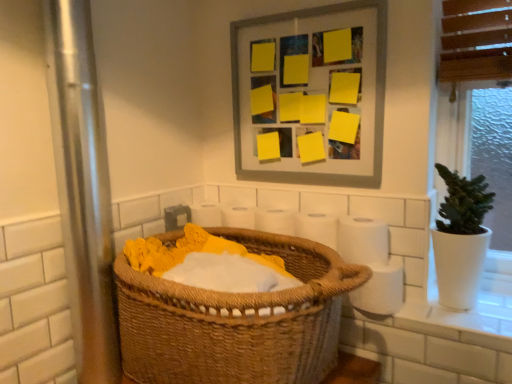
Question: From the image's perspective, is white matte toilet paper at right, which is counted as the 2th toilet paper, starting from the top, positioned above or below white matte toilet paper at right, which appears as the first toilet paper when ordered from the bottom?

Choices:
 (A) below
 (B) above

Answer: (B)

Question: From a real-world perspective, is white matte toilet paper at right, the 2th toilet paper positioned from the bottom, physically located above or below white matte toilet paper at right, which appears as the first toilet paper when ordered from the bottom?

Choices:
 (A) above
 (B) below

Answer: (A)

Question: Estimate the real-world distances between objects in this image. Which object is closer to the white matte toilet paper at right, the 2th toilet paper positioned from the bottom?

Choices:
 (A) white paper at center, which appears as the 1th toilet paper when viewed from the top
 (B) woven brown basket at center
 (C) matte gray picture frame at upper center
 (D) white matte toilet paper at right, which appears as the first toilet paper when ordered from the bottom

Answer: (A)

Question: Estimate the real-world distances between objects in this image. Which object is closer to the white matte toilet paper at right, the 3th toilet paper in the top-to-bottom sequence?

Choices:
 (A) matte gray picture frame at upper center
 (B) white paper at center, the 3th toilet paper positioned from the bottom
 (C) white matte toilet paper at right, which is counted as the 2th toilet paper, starting from the top
 (D) woven brown basket at center

Answer: (C)